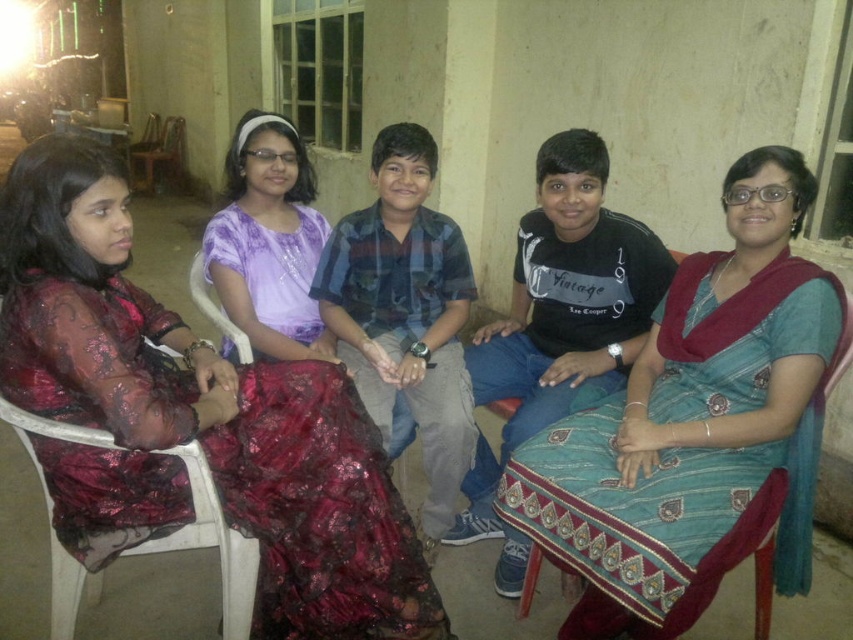
Does teal silk saree at center have a greater width compared to wooden chair at left?

Incorrect, teal silk saree at center's width does not surpass wooden chair at left's.

Is point (666, 556) farther from viewer compared to point (184, 157)?

No, (666, 556) is closer to viewer.

Locate an element on the screen. teal silk saree at center is located at coordinates (695, 428).

Does white plastic chair at left appear on the left side of wooden chair at left?

No, white plastic chair at left is not to the left of wooden chair at left.

Is point (248, 554) farther from viewer compared to point (161, 173)?

No.

Where is `white plastic chair at left`? The width and height of the screenshot is (853, 640). white plastic chair at left is located at coordinates pyautogui.click(x=212, y=544).

From the picture: Which is more to the right, teal silk saree at center or white plastic chair at left?

teal silk saree at center is more to the right.

Does teal silk saree at center have a lesser width compared to white plastic chair at left?

No, teal silk saree at center is not thinner than white plastic chair at left.

Between point (802, 580) and point (201, 516), which one is positioned behind?

The point (802, 580) is behind.

I want to click on teal silk saree at center, so click(695, 428).